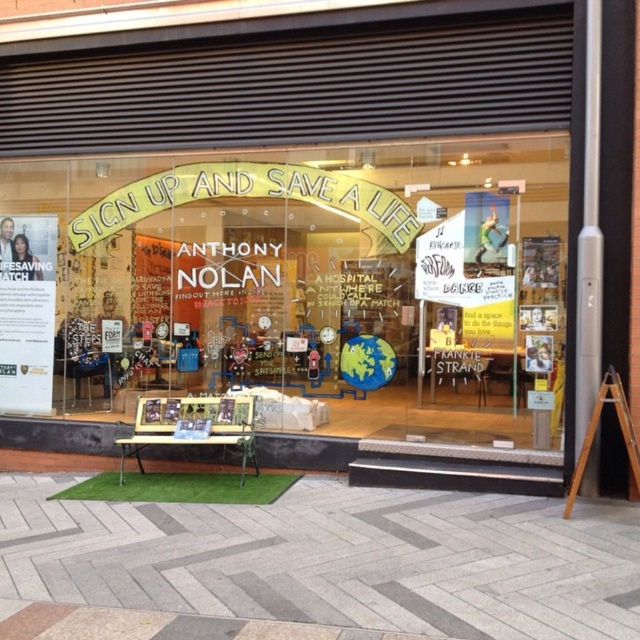
Does point (387, 310) lie behind point (611, 387)?

Yes, it is behind point (611, 387).

Who is positioned more to the right, matte glass sign at center or wooden sign at lower right?

wooden sign at lower right

Is point (474, 188) closer to viewer compared to point (625, 412)?

That is False.

Identify the location of matte glass sign at center. (296, 285).